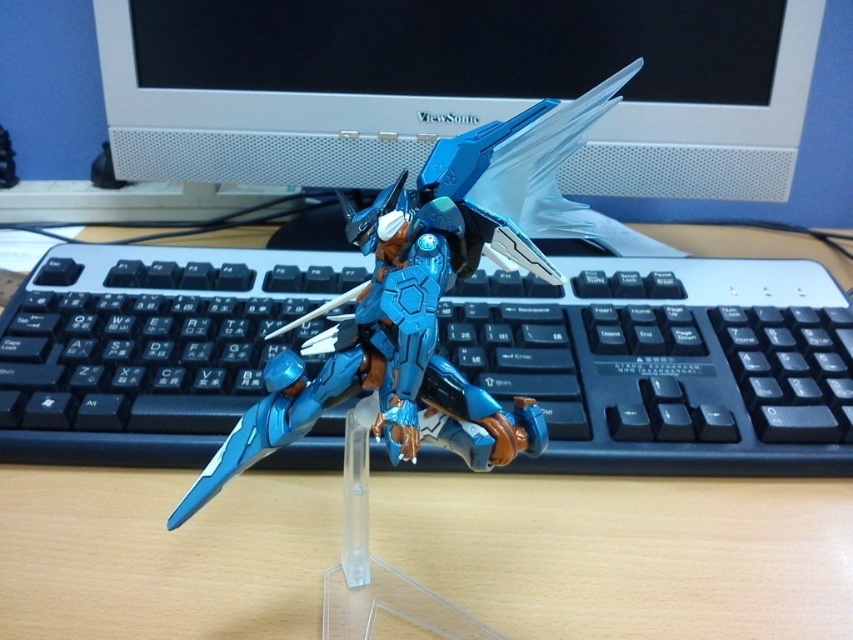
Question: Which object is positioned farthest from the white plastic monitor at upper center?

Choices:
 (A) metallic blue robot at center
 (B) wooden table at center

Answer: (B)

Question: Can you confirm if wooden table at center is positioned to the left of white plastic monitor at upper center?

Choices:
 (A) yes
 (B) no

Answer: (A)

Question: Among these objects, which one is farthest from the camera?

Choices:
 (A) metallic blue robot at center
 (B) wooden table at center
 (C) white plastic monitor at upper center

Answer: (C)

Question: In this image, where is wooden table at center located relative to metallic blue robot at center?

Choices:
 (A) above
 (B) below

Answer: (B)

Question: Does wooden table at center appear on the right side of white plastic monitor at upper center?

Choices:
 (A) yes
 (B) no

Answer: (B)

Question: Which of the following is the farthest from the observer?

Choices:
 (A) (183, 4)
 (B) (68, 628)

Answer: (A)